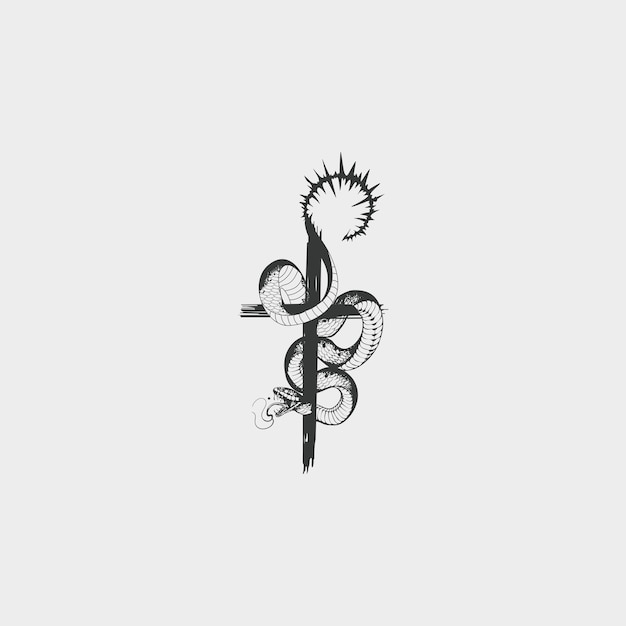
Image resolution: width=626 pixels, height=626 pixels. What are the coordinates of `scales` in the screenshot? It's located at tap(269, 290), tap(327, 377).